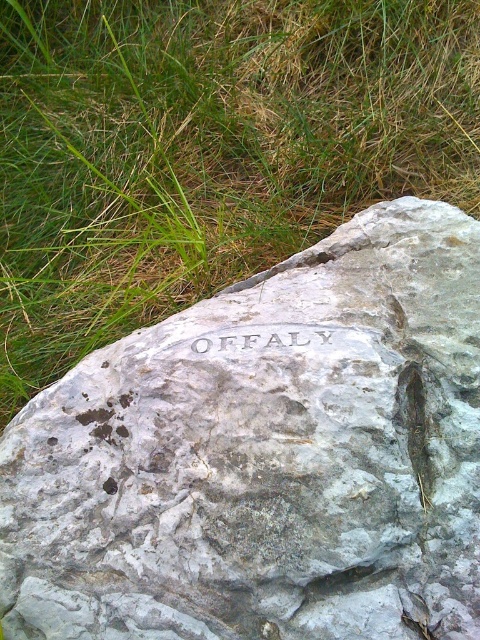
You are a gardener trying to place a new decorative stone in the garden. You have a gray stone engraving at center that you want to position next to the green grass at upper left. Which area has more space available for placing the stone?

The green grass at upper left might be wider than the gray stone engraving at center, so the green grass at upper left has more space available for placing the stone.

You are a geologist examining the gray stone boulder at center and the gray stone engraving at center. Which object is positioned higher up on the rock?

The gray stone engraving at center is positioned higher up on the rock than the gray stone boulder at center.